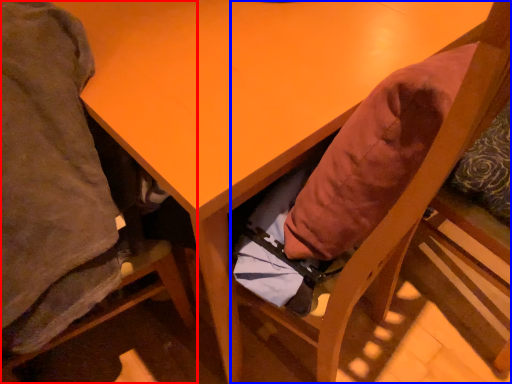
Question: Which object appears farthest to the camera in this image, chair (highlighted by a red box) or chair (highlighted by a blue box)?

Choices:
 (A) chair
 (B) chair

Answer: (B)